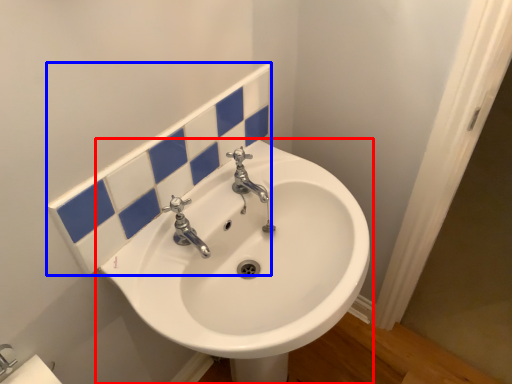
Question: Which object appears farthest to the camera in this image, sink (highlighted by a red box) or tile (highlighted by a blue box)?

Choices:
 (A) sink
 (B) tile

Answer: (B)